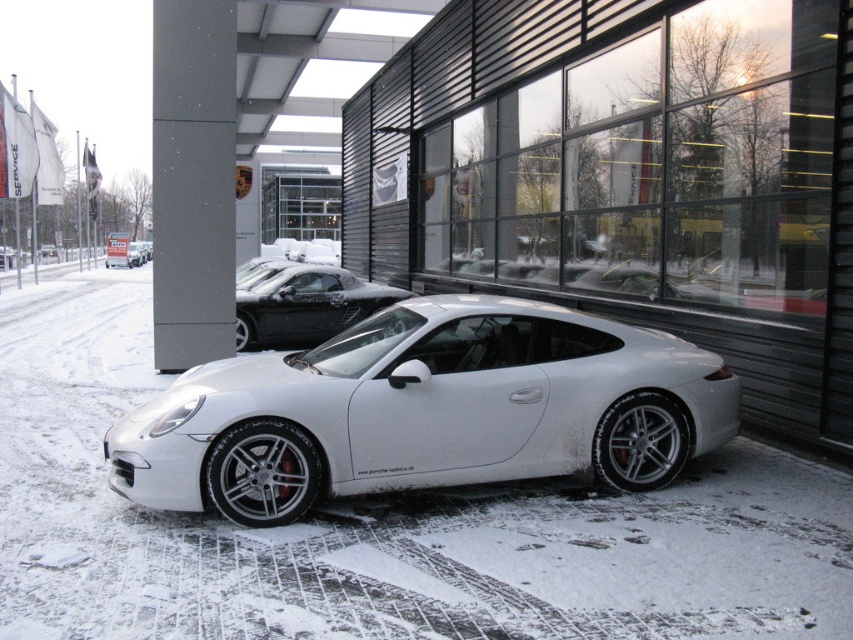
You are standing at the entrance of the dealership and want to take a photo of the white metallic sports car at center. Given that your camera has a focal length of 50mm and you are positioned at point 0, can you estimate whether you need to zoom in or out to frame the car properly?

The white metallic sports car at center is located at point (426,410), which means it is positioned to the right and slightly above the center of your view. To frame it properly, you might need to zoom out slightly to ensure the car is centered within your camera frame at 50mm focal length.